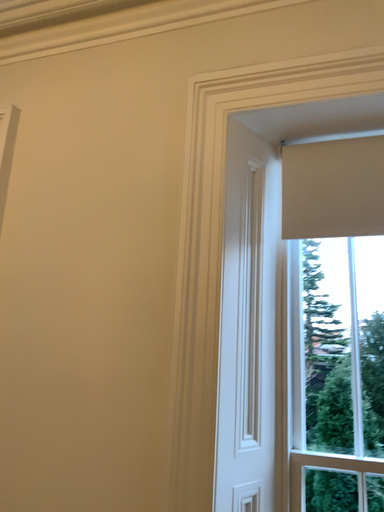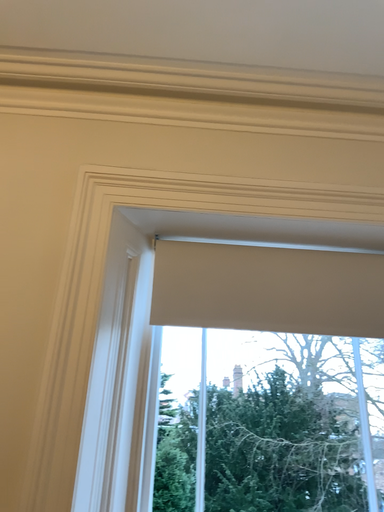
Question: Which way did the camera rotate in the video?

Choices:
 (A) rotated right
 (B) rotated left

Answer: (A)